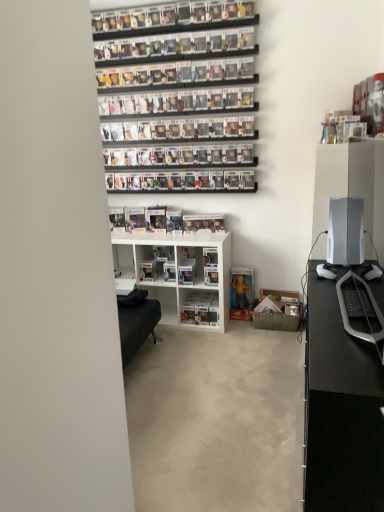
What do you see at coordinates (340, 410) in the screenshot? I see `black glossy desk at right` at bounding box center [340, 410].

The image size is (384, 512). What do you see at coordinates (345, 232) in the screenshot? I see `white glossy desktop at right` at bounding box center [345, 232].

Describe the element at coordinates (216, 421) in the screenshot. This screenshot has height=512, width=384. I see `beige carpet at center` at that location.

This screenshot has height=512, width=384. What are the coordinates of `black glossy desk at right` in the screenshot? It's located at (340, 410).

From a real-world perspective, which object rests below the other?

white plastic shelf at center, which is the 2th shelf in left-to-right order, is physically lower.

Does white plastic shelf at center, the first shelf when ordered from right to left, contain black glossy desk at right?

No, black glossy desk at right is located outside of white plastic shelf at center, the first shelf when ordered from right to left.

From the image's perspective, does white plastic shelf at center, which is the 2th shelf in left-to-right order, appear higher than black glossy desk at right?

Yes, from the image's perspective, white plastic shelf at center, which is the 2th shelf in left-to-right order, is on top of black glossy desk at right.

From a real-world perspective, between black glossy desk at right and white matte shelf at center, placed as the 1th shelf when sorted from left to right, who is vertically higher?

white matte shelf at center, placed as the 1th shelf when sorted from left to right.

What's the angular difference between black glossy desk at right and white matte shelf at center, placed as the second shelf when sorted from right to left,'s facing directions?

89.5 degrees separate the facing orientations of black glossy desk at right and white matte shelf at center, placed as the second shelf when sorted from right to left.

Can you confirm if black glossy desk at right is thinner than white matte shelf at center, placed as the 1th shelf when sorted from left to right?

No.

Is there a large distance between black glossy desk at right and white matte shelf at center, placed as the 1th shelf when sorted from left to right?

black glossy desk at right is positioned a significant distance from white matte shelf at center, placed as the 1th shelf when sorted from left to right.

Considering the sizes of yellow matte action figure at lower center and black glossy desk at right in the image, is yellow matte action figure at lower center bigger or smaller than black glossy desk at right?

Considering their sizes, yellow matte action figure at lower center takes up less space than black glossy desk at right.

Is yellow matte action figure at lower center not near black glossy desk at right?

yellow matte action figure at lower center is positioned a significant distance from black glossy desk at right.

Consider the image. Visually, is yellow matte action figure at lower center positioned to the left or to the right of black glossy desk at right?

yellow matte action figure at lower center is to the left of black glossy desk at right.

Do you think yellow matte action figure at lower center is within black glossy desk at right, or outside of it?

yellow matte action figure at lower center cannot be found inside black glossy desk at right.

Is white glossy desktop at right behind white plastic shelf at center, which is the 2th shelf in left-to-right order?

No.

Is white glossy desktop at right taller or shorter than white plastic shelf at center, which is the 2th shelf in left-to-right order?

Considering their sizes, white glossy desktop at right has more height than white plastic shelf at center, which is the 2th shelf in left-to-right order.

From a real-world perspective, which object rests below the other?

white plastic shelf at center, which is the 2th shelf in left-to-right order, is physically lower.

In the scene shown: Is white glossy desktop at right situated inside white plastic shelf at center, which is the 2th shelf in left-to-right order, or outside?

white glossy desktop at right is not enclosed by white plastic shelf at center, which is the 2th shelf in left-to-right order.

Between point (250, 438) and point (184, 309), which one is positioned in front?

The point (250, 438) is in front.

Who is more distant, beige carpet at center or white plastic shelf at center, the first shelf when ordered from right to left?

white plastic shelf at center, the first shelf when ordered from right to left, is behind.

Is beige carpet at center facing away from white plastic shelf at center, which is the 2th shelf in left-to-right order?

No, beige carpet at center is not facing away from white plastic shelf at center, which is the 2th shelf in left-to-right order.

How far apart are white matte shelf at center, placed as the second shelf when sorted from right to left, and black glossy desk at right?

1.54 meters.

Is white matte shelf at center, placed as the 1th shelf when sorted from left to right, smaller than black glossy desk at right?

Yes, white matte shelf at center, placed as the 1th shelf when sorted from left to right, is smaller than black glossy desk at right.

Can you see white matte shelf at center, placed as the second shelf when sorted from right to left, touching black glossy desk at right?

They are not placed beside each other.

Is white matte shelf at center, placed as the second shelf when sorted from right to left, facing towards black glossy desk at right?

No, white matte shelf at center, placed as the second shelf when sorted from right to left, is not facing towards black glossy desk at right.

From a real-world perspective, which object stands above the other?

clear plastic figure at center.

Who is smaller, black glossy desk at right or clear plastic figure at center?

Smaller between the two is clear plastic figure at center.

You are a GUI agent. You are given a task and a screenshot of the screen. Output one action in this format:
    pyautogui.click(x=<x>, y=<y>)
    Task: Click on the book on the left of black glossy desk at right
    
    Given the screenshot: What is the action you would take?
    pyautogui.click(x=203, y=222)

Does black glossy desk at right come behind clear plastic figure at center?

No.

The image size is (384, 512). I want to click on the 1st shelf counting from the left of the black glossy desk at right, so click(x=201, y=309).

From the image's perspective, starting from the black glossy desk at right, which shelf is the 2nd one above? Please provide its 2D coordinates.

[(178, 270)]

When comparing their distances from yellow matte action figure at lower center, does clear plastic figure at center or white matte shelf at center, placed as the second shelf when sorted from right to left, seem closer?

white matte shelf at center, placed as the second shelf when sorted from right to left, lies closer to yellow matte action figure at lower center than the other object.

Looking at the image, which one is located closer to beige carpet at center, black glossy desk at right or yellow matte action figure at lower center?

Among the two, black glossy desk at right is located nearer to beige carpet at center.

Looking at the image, which one is located further to clear plastic figure at center, white plastic shelf at center, the first shelf when ordered from right to left, or white glossy desktop at right?

Among the two, white glossy desktop at right is located further to clear plastic figure at center.

Considering their positions, is white glossy desktop at right positioned closer to clear plastic figure at center than black glossy desk at right?

white glossy desktop at right.

Looking at the image, which one is located further to clear plastic figure at center, white matte shelf at center, placed as the 1th shelf when sorted from left to right, or black glossy desk at right?

Based on the image, black glossy desk at right appears to be further to clear plastic figure at center.

Based on their spatial positions, is yellow matte action figure at lower center or beige carpet at center further from white matte shelf at center, placed as the 1th shelf when sorted from left to right?

beige carpet at center is further to white matte shelf at center, placed as the 1th shelf when sorted from left to right.

Estimate the real-world distances between objects in this image. Which object is closer to yellow matte action figure at lower center, clear plastic figure at center or white plastic shelf at center, which is the 2th shelf in left-to-right order?

white plastic shelf at center, which is the 2th shelf in left-to-right order, lies closer to yellow matte action figure at lower center than the other object.

Based on their spatial positions, is white matte shelf at center, placed as the second shelf when sorted from right to left, or black glossy desk at right closer to white glossy desktop at right?

black glossy desk at right.

The height and width of the screenshot is (512, 384). What are the coordinates of `desktop computer positioned between black glossy desk at right and white matte shelf at center, placed as the 1th shelf when sorted from left to right, from near to far` in the screenshot? It's located at (345, 232).

This screenshot has height=512, width=384. Identify the location of desktop computer positioned between black glossy desk at right and white plastic shelf at center, the first shelf when ordered from right to left, from near to far. (345, 232).

The width and height of the screenshot is (384, 512). In order to click on shelf between white matte shelf at center, placed as the second shelf when sorted from right to left, and white glossy desktop at right in this screenshot , I will do `click(201, 309)`.

Where is `book between white matte shelf at center, placed as the 1th shelf when sorted from left to right, and yellow matte action figure at lower center from left to right`? book between white matte shelf at center, placed as the 1th shelf when sorted from left to right, and yellow matte action figure at lower center from left to right is located at coordinates (203, 222).